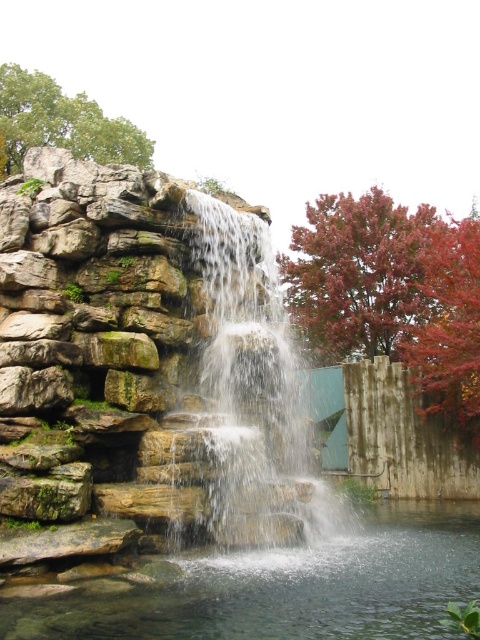
You are a hiker who just arrived at the waterfall. You want to take a photo of the red matte tree at upper right. Considering your camera has a maximum zoom range of 50 meters, can you capture the tree clearly without moving closer?

The red matte tree at upper right is 57.96 meters away from camera. Since your camera can only zoom up to 50 meters, you cannot capture the tree clearly without moving closer.

You are a photographer planning to capture the waterfall scene. You want to ensure the clear water at center and the red matte tree at upper right are both visible in your shot. Based on their positions, which object will appear closer to the camera in the final photograph?

The clear water at center appears closer to the camera because it is positioned in front of the red matte tree at upper right.

You are standing at the base of the waterfall and notice two trees in the background. The red matte tree at upper right and the green leafy tree at upper left. Which tree is closer to you?

The red matte tree at upper right is closer to you because it is in front of the green leafy tree at upper left.